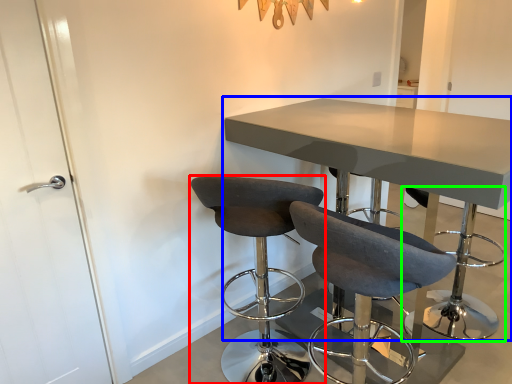
Question: Based on their relative distances, which object is farther from chair (highlighted by a red box)? Choose from table (highlighted by a blue box) and bar stool (highlighted by a green box).

Choices:
 (A) table
 (B) bar stool

Answer: (B)